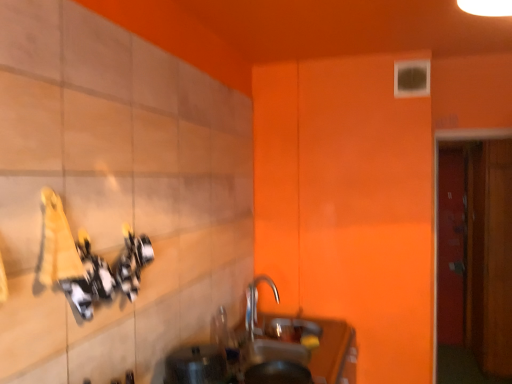
Question: Is the position of smooth brown countertop at lower center less distant than that of silver metallic tap at center?

Choices:
 (A) no
 (B) yes

Answer: (B)

Question: Is smooth brown countertop at lower center thinner than silver metallic tap at center?

Choices:
 (A) no
 (B) yes

Answer: (A)

Question: From the image's perspective, is smooth brown countertop at lower center over silver metallic tap at center?

Choices:
 (A) yes
 (B) no

Answer: (B)

Question: Is smooth brown countertop at lower center looking in the opposite direction of silver metallic tap at center?

Choices:
 (A) no
 (B) yes

Answer: (A)

Question: From a real-world perspective, is smooth brown countertop at lower center positioned under silver metallic tap at center based on gravity?

Choices:
 (A) yes
 (B) no

Answer: (A)

Question: Is the depth of smooth brown countertop at lower center greater than that of silver metallic tap at center?

Choices:
 (A) no
 (B) yes

Answer: (A)

Question: Is silver metallic tap at center at the right side of metallic silver sink at lower center?

Choices:
 (A) no
 (B) yes

Answer: (B)

Question: Is silver metallic tap at center closer to camera compared to metallic silver sink at lower center?

Choices:
 (A) yes
 (B) no

Answer: (B)

Question: Is silver metallic tap at center outside of metallic silver sink at lower center?

Choices:
 (A) no
 (B) yes

Answer: (B)

Question: Is silver metallic tap at center smaller than metallic silver sink at lower center?

Choices:
 (A) no
 (B) yes

Answer: (A)

Question: Is metallic silver sink at lower center at the back of silver metallic tap at center?

Choices:
 (A) yes
 (B) no

Answer: (B)

Question: From a real-world perspective, is silver metallic tap at center located higher than metallic silver sink at lower center?

Choices:
 (A) yes
 (B) no

Answer: (B)

Question: Is metallic silver sink at lower center completely or partially outside of silver metallic tap at center?

Choices:
 (A) yes
 (B) no

Answer: (A)